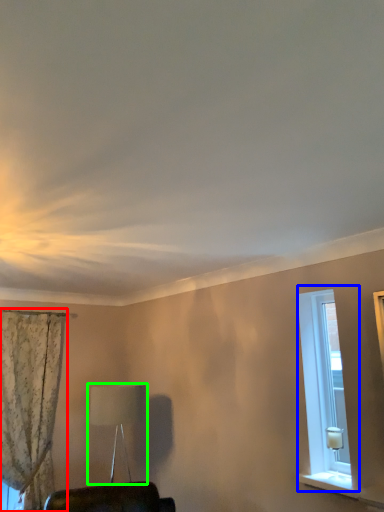
Question: Which object is the closest to the curtain (highlighted by a red box)? Choose among these: window (highlighted by a blue box) or table lamp (highlighted by a green box).

Choices:
 (A) window
 (B) table lamp

Answer: (B)